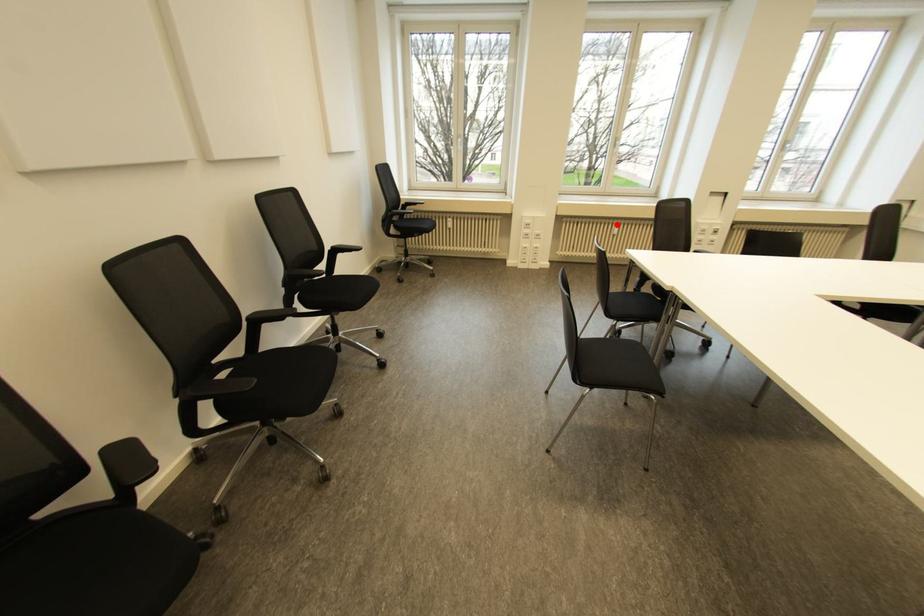
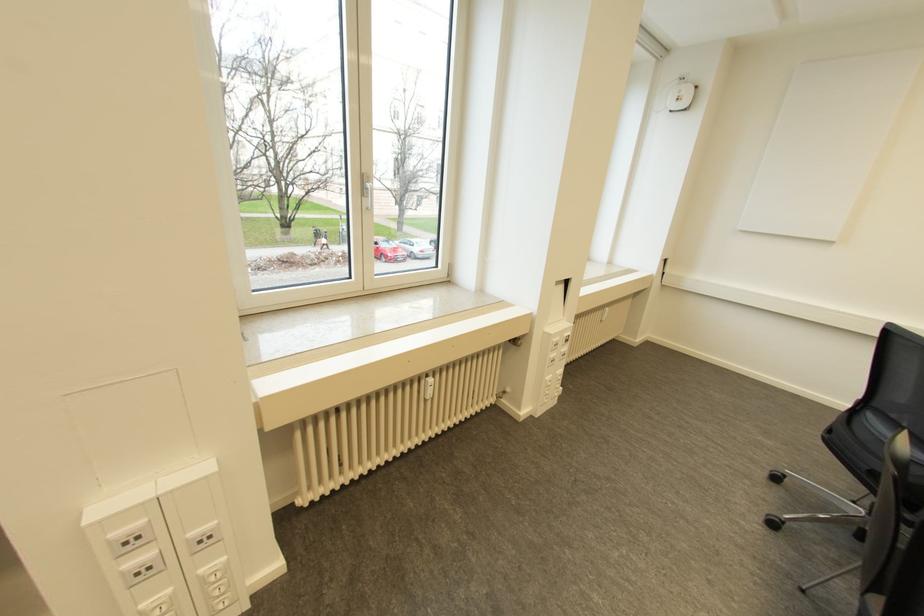
Question: I am providing you with two images of the same scene from different viewpoints. A red point is shown in image1. For the corresponding object point in image2, is it positioned nearer or farther from the camera?

Choices:
 (A) Nearer
 (B) Farther

Answer: (A)